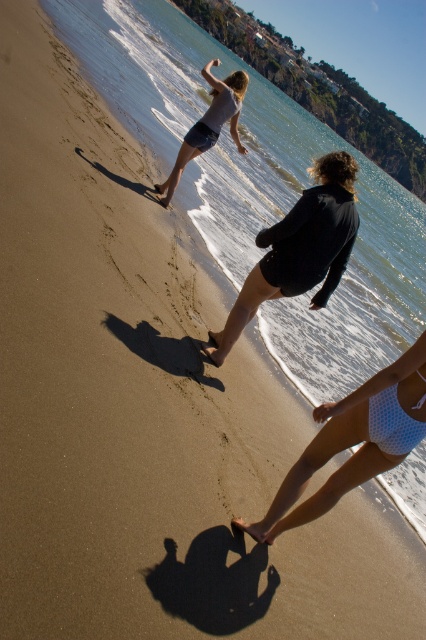
Which is below, white polka dot swimsuit at lower center or matte gray shorts at upper center?

white polka dot swimsuit at lower center is below.

Which is above, white polka dot swimsuit at lower center or matte gray shorts at upper center?

matte gray shorts at upper center

Is point (414, 406) positioned in front of point (227, 96)?

Yes, it is in front of point (227, 96).

At what (x,y) coordinates should I click in order to perform the action: click on white polka dot swimsuit at lower center. Please return your answer as a coordinate pair (x, y). This screenshot has width=426, height=640. Looking at the image, I should click on (353, 442).

Which is below, black matte shorts at center or white mesh bikini top at lower right?

Positioned lower is white mesh bikini top at lower right.

Can you confirm if black matte shorts at center is taller than white mesh bikini top at lower right?

Indeed, black matte shorts at center has a greater height compared to white mesh bikini top at lower right.

I want to click on black matte shorts at center, so click(299, 250).

Is white polka dot swimsuit at lower center to the right of white mesh bikini top at lower right from the viewer's perspective?

No, white polka dot swimsuit at lower center is not to the right of white mesh bikini top at lower right.

Who is higher up, white polka dot swimsuit at lower center or white mesh bikini top at lower right?

white mesh bikini top at lower right

At what (x,y) coordinates should I click in order to perform the action: click on white polka dot swimsuit at lower center. Please return your answer as a coordinate pair (x, y). The image size is (426, 640). Looking at the image, I should click on (353, 442).